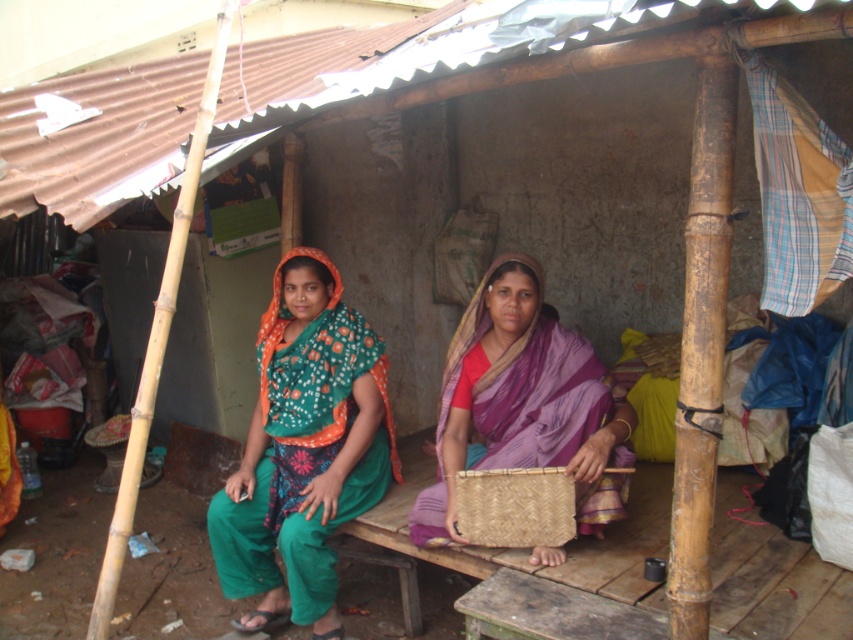
Does purple woven basket at center have a larger size compared to woven straw basket at center?

Yes, purple woven basket at center is bigger than woven straw basket at center.

Between purple woven basket at center and woven straw basket at center, which one has less height?

woven straw basket at center is shorter.

Which is behind, point (598, 486) or point (569, 490)?

The point (598, 486) is more distant.

The height and width of the screenshot is (640, 853). I want to click on purple woven basket at center, so click(524, 403).

Consider the image. Does green printed saree at center have a lesser width compared to purple woven basket at center?

Correct, green printed saree at center's width is less than purple woven basket at center's.

Identify the location of green printed saree at center. (305, 449).

Is green printed saree at center behind woven straw basket at center?

Yes, it is behind woven straw basket at center.

Does green printed saree at center appear under woven straw basket at center?

No, green printed saree at center is not below woven straw basket at center.

Locate an element on the screen. green printed saree at center is located at coordinates pyautogui.click(x=305, y=449).

I want to click on green printed saree at center, so click(305, 449).